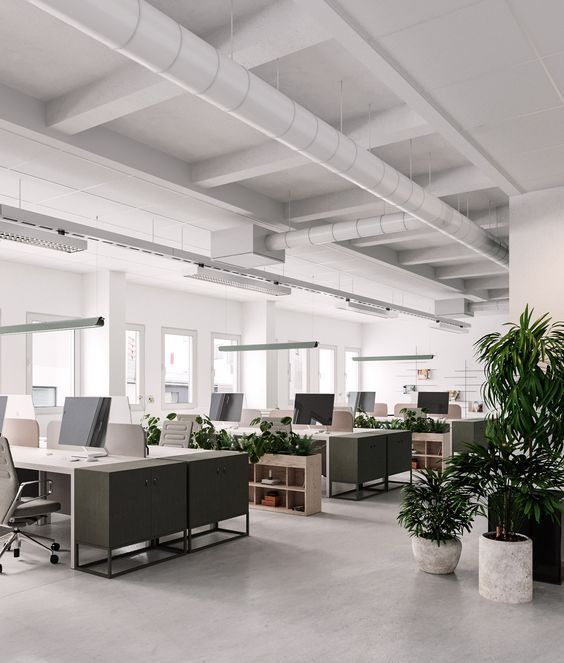
Find the location of a particular element. desk dividers is located at coordinates (456, 412), (407, 404), (380, 406), (341, 420), (282, 412), (245, 410), (193, 414), (129, 437), (56, 425), (13, 423).